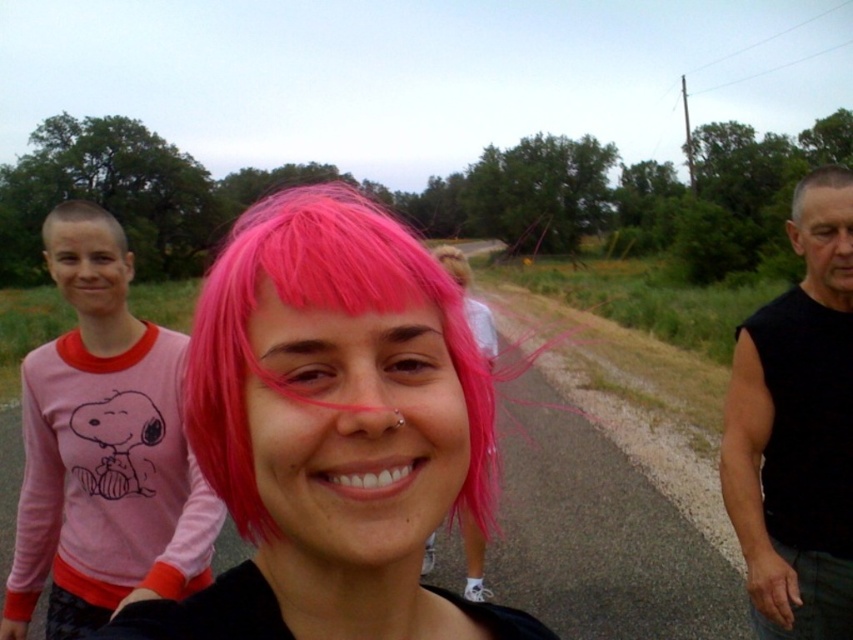
You are standing at the point marked by coordinates point [315,212] and want to take a photo of the central figure with pink hair. The camera you have can focus on subjects within 50 centimeters. Will the camera be able to capture the central figure clearly?

The distance between point [315,212] and the camera is 48.92 centimeters, which is within the camera focus range of 50 centimeters. Therefore, the camera will be able to capture the central figure clearly.

You are a photographer trying to capture a group photo of the pink matte wig at center and gray matte hair at upper right. Since you want both subjects to be in the frame, which direction should you move your camera to ensure both are visible?

The pink matte wig at center is to the left of gray matte hair at upper right, so you should move your camera to the right to ensure both subjects are visible in the frame.